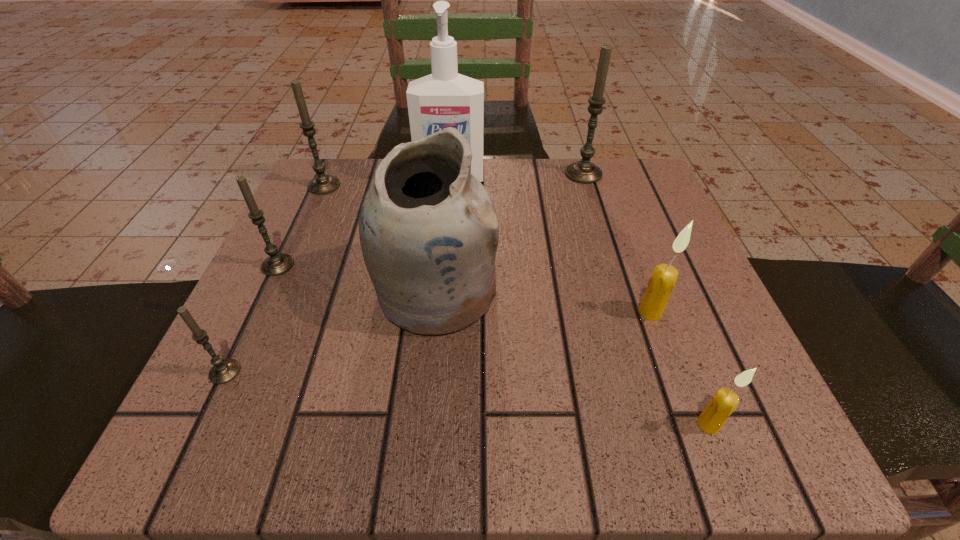
The width and height of the screenshot is (960, 540). Identify the location of the fifth farthest candle. (224, 370).

The height and width of the screenshot is (540, 960). Identify the location of the smaller cream candle. (724, 402).

Where is `the nearest candle`? This screenshot has width=960, height=540. the nearest candle is located at coordinates (724, 402).

Identify the location of vacant space located 0.050m on the front label of the tallest object. This screenshot has width=960, height=540. (448, 206).

Locate an element on the screen. vacant space situated 0.330m on the left of the rightmost gray candle is located at coordinates (415, 174).

Find the location of `vacant space positioned 0.090m on the front of the pottery`. vacant space positioned 0.090m on the front of the pottery is located at coordinates (425, 393).

Image resolution: width=960 pixels, height=540 pixels. I want to click on free region located on the right of the second biggest gray candle, so click(434, 186).

You are a GUI agent. You are given a task and a screenshot of the screen. Output one action in this format:
    pyautogui.click(x=<x>, y=<y>)
    Task: Click on the vacant region located 0.090m on the left of the fourth farthest candle
    
    Given the screenshot: What is the action you would take?
    pyautogui.click(x=581, y=312)

At what (x,y) coordinates should I click in order to perform the action: click on vacant space located 0.170m on the front of the third farthest candle. Please return your answer as a coordinate pair (x, y). This screenshot has width=960, height=540. Looking at the image, I should click on (232, 361).

Locate an element on the screen. This screenshot has height=540, width=960. vacant region located 0.150m on the back of the seventh farthest object is located at coordinates (267, 284).